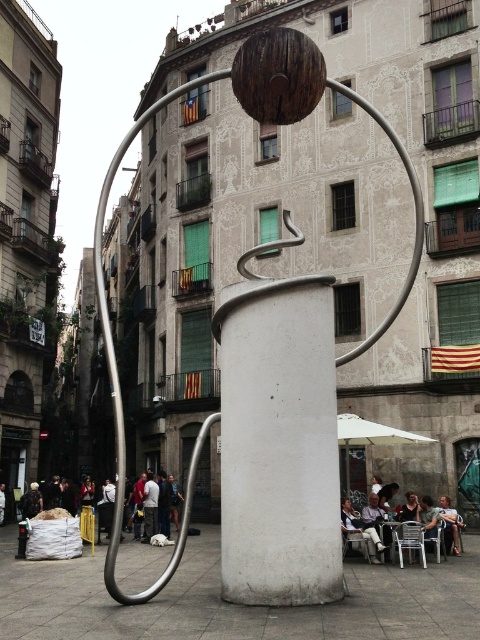
You are a visitor in the public square and want to take a photo of the white matte pillar at center while sitting on the white fabric chair at lower right. Will the pillar be fully visible in the photo if you sit on the chair?

The white matte pillar at center is much taller than the white fabric chair at lower right, so when sitting on the chair, the pillar will still be fully visible in the photo as its height exceeds the chair.

You are a visitor standing in front of the sculpture and want to sit on the matte white chair at lower center. Can you see the top of the white matte pillar at center from your seated position?

The white matte pillar at center is above the matte white chair at lower center, so when you sit on the matte white chair at lower center, you can still see the top of the white matte pillar at center since it is positioned higher up.

Looking at this image, you are a photographer standing in the public square. You want to take a photo of the white matte pillar at center without the white fabric chair at lower right appearing in the background. Is this possible given their positions?

The white matte pillar at center is in front of the white fabric chair at lower right, so if you position yourself so that the pillar blocks the view of the chair, you can take the photo without the chair appearing in the background.